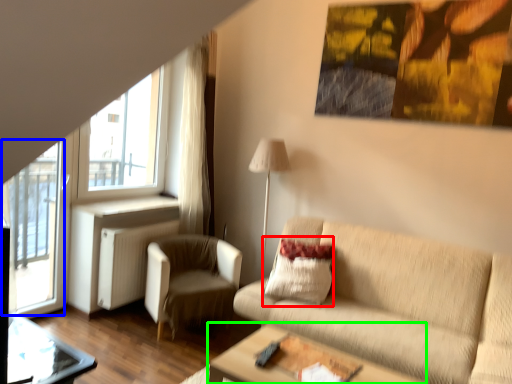
Question: Based on their relative distances, which object is farther from pillow (highlighted by a red box)? Choose from screen door (highlighted by a blue box) and table (highlighted by a green box).

Choices:
 (A) screen door
 (B) table

Answer: (A)